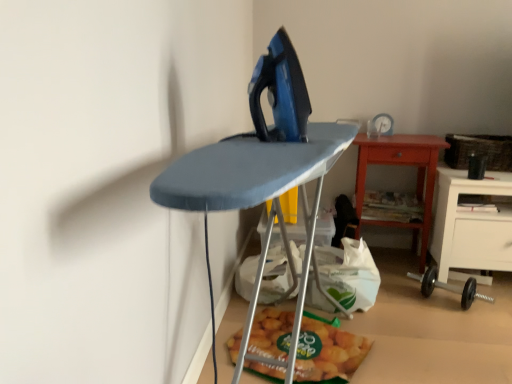
Find the location of a particular element. vacant region to the left of black rubber dumbbell at lower right is located at coordinates (396, 306).